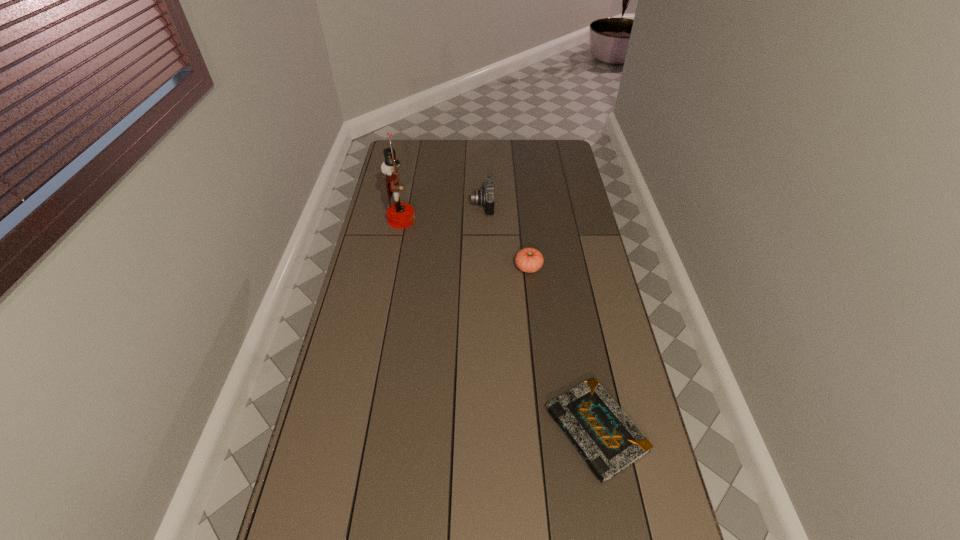
Locate an element on the screen. Image resolution: width=960 pixels, height=540 pixels. free space that satisfies the following two spatial constraints: 1. on the front-facing side of the third object from right to left; 2. on the right side of the tomato is located at coordinates click(x=483, y=267).